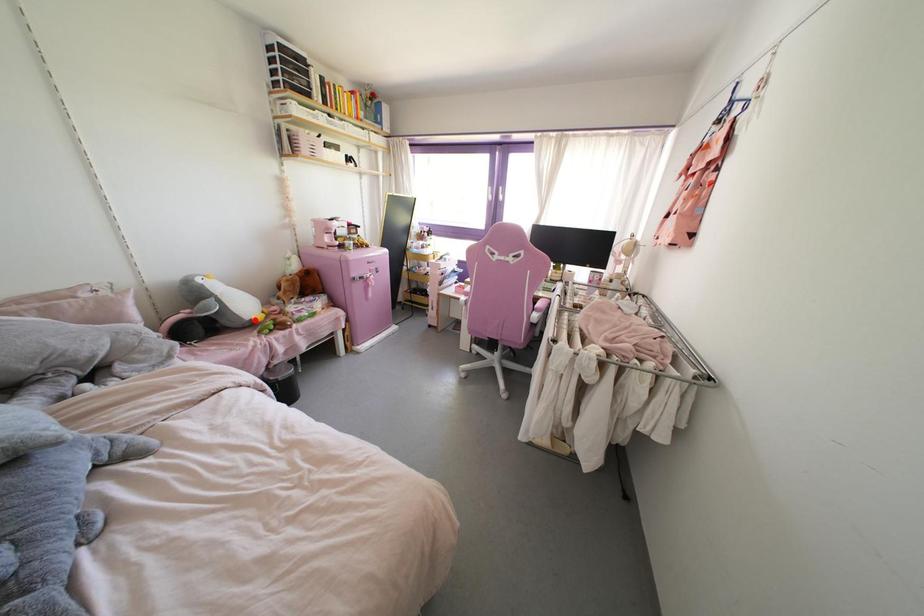
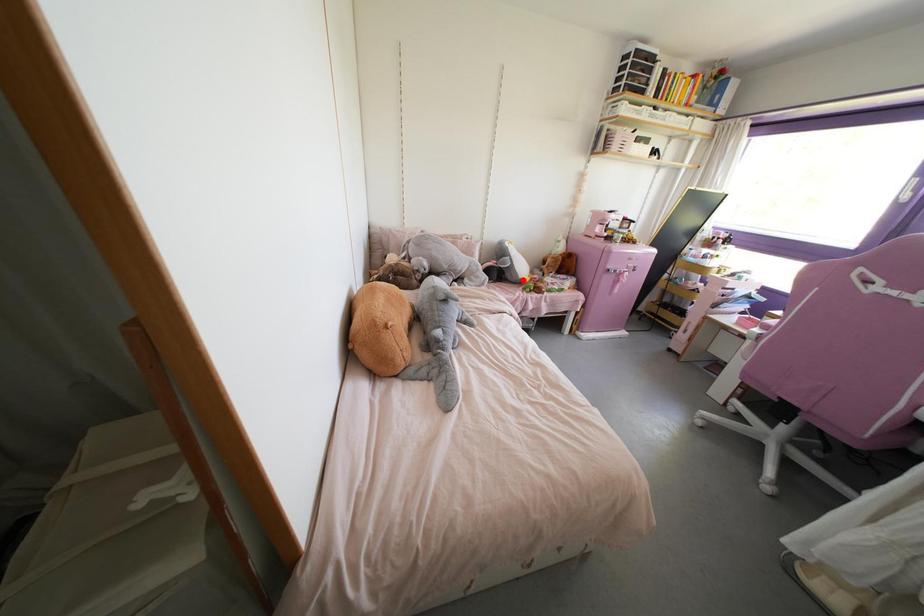
I am providing you with two images of the same scene from different viewpoints. A red point is marked on the first image and another point is marked on the second image. Do the highlighted points in image1 and image2 indicate the same real-world spot?

Yes